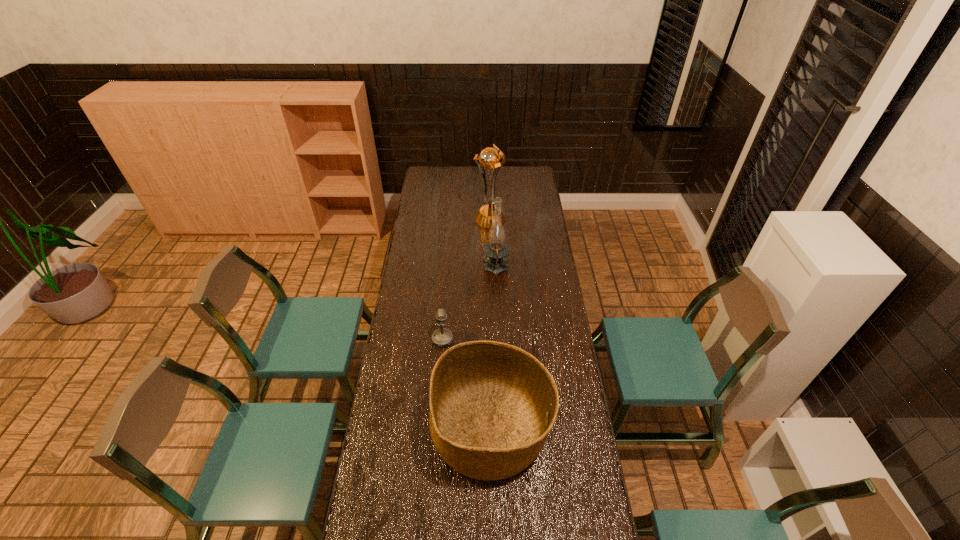
The width and height of the screenshot is (960, 540). I want to click on the second closest object relative to the third farthest object, so click(x=496, y=250).

In order to click on object that is the second nearest to the shortest object in this screenshot , I will do `click(496, 250)`.

You are a GUI agent. You are given a task and a screenshot of the screen. Output one action in this format:
    pyautogui.click(x=<x>, y=<y>)
    Task: Click on the free space that satisfies the following two spatial constraints: 1. on the front-facing side of the third nearest object; 2. on the right side of the farthest object
    
    Given the screenshot: What is the action you would take?
    pyautogui.click(x=491, y=268)

Where is `free space that satisfies the following two spatial constraints: 1. on the front-facing side of the farthest object; 2. on the front-facing side of the shortest object`? The height and width of the screenshot is (540, 960). free space that satisfies the following two spatial constraints: 1. on the front-facing side of the farthest object; 2. on the front-facing side of the shortest object is located at coordinates (492, 340).

I want to click on free space that satisfies the following two spatial constraints: 1. on the front-facing side of the trophy; 2. on the front-facing side of the second nearest object, so click(492, 340).

Locate an element on the screen. This screenshot has width=960, height=540. free spot that satisfies the following two spatial constraints: 1. on the front-facing side of the trophy; 2. on the left side of the oil lamp is located at coordinates (491, 268).

The height and width of the screenshot is (540, 960). I want to click on vacant region that satisfies the following two spatial constraints: 1. on the front-facing side of the third farthest object; 2. on the right side of the third tallest object, so click(436, 430).

This screenshot has height=540, width=960. What are the coordinates of `free space that satisfies the following two spatial constraints: 1. on the back side of the nearest object; 2. on the front-facing side of the second nearest object` in the screenshot? It's located at (489, 340).